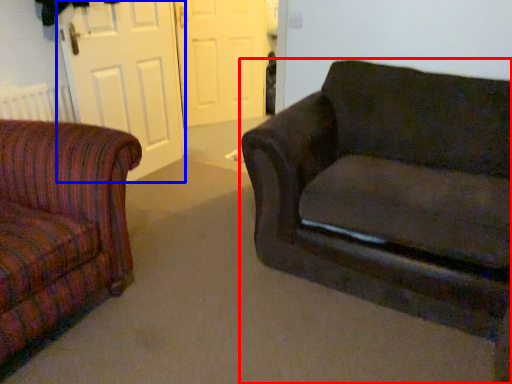
Question: Which object is closer to the camera taking this photo, studio couch (highlighted by a red box) or screen door (highlighted by a blue box)?

Choices:
 (A) studio couch
 (B) screen door

Answer: (A)